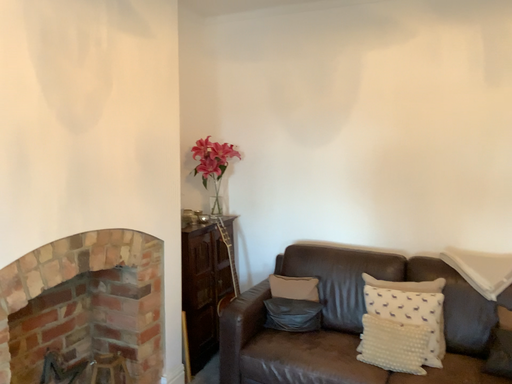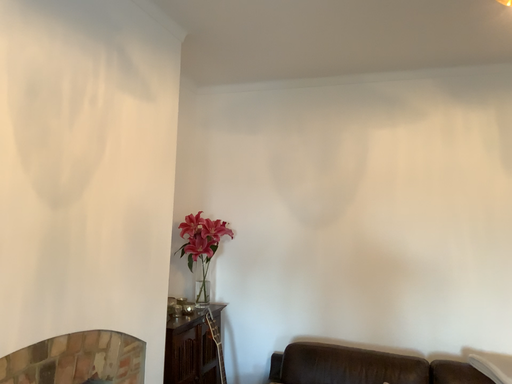
Question: How did the camera likely rotate when shooting the video?

Choices:
 (A) rotated upward
 (B) rotated downward

Answer: (A)